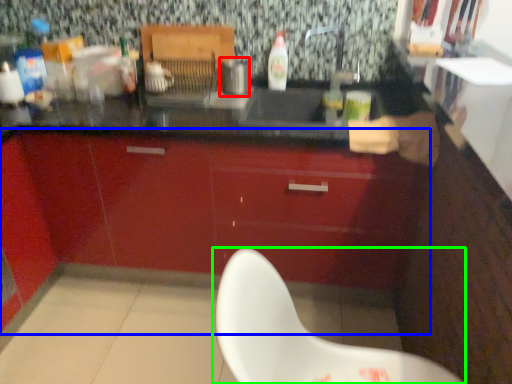
Question: Which object is the farthest from appliance (highlighted by a red box)? Choose among these: cabinetry (highlighted by a blue box) or chair (highlighted by a green box).

Choices:
 (A) cabinetry
 (B) chair

Answer: (B)